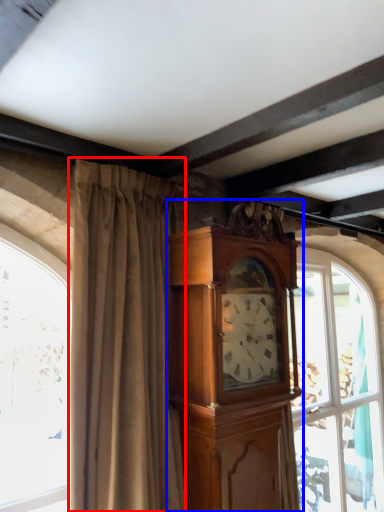
Question: Which point is closer to the camera, curtain (highlighted by a red box) or cabinetry (highlighted by a blue box)?

Choices:
 (A) curtain
 (B) cabinetry

Answer: (A)